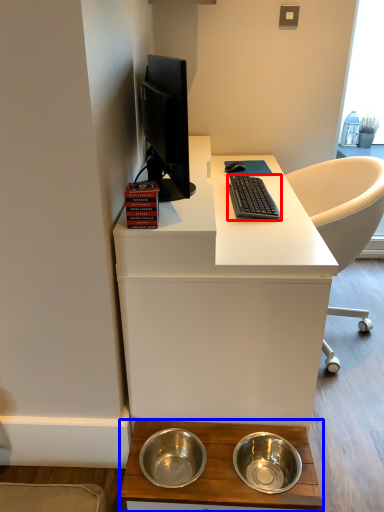
Question: Which object is further to the camera taking this photo, computer keyboard (highlighted by a red box) or desk (highlighted by a blue box)?

Choices:
 (A) computer keyboard
 (B) desk

Answer: (A)